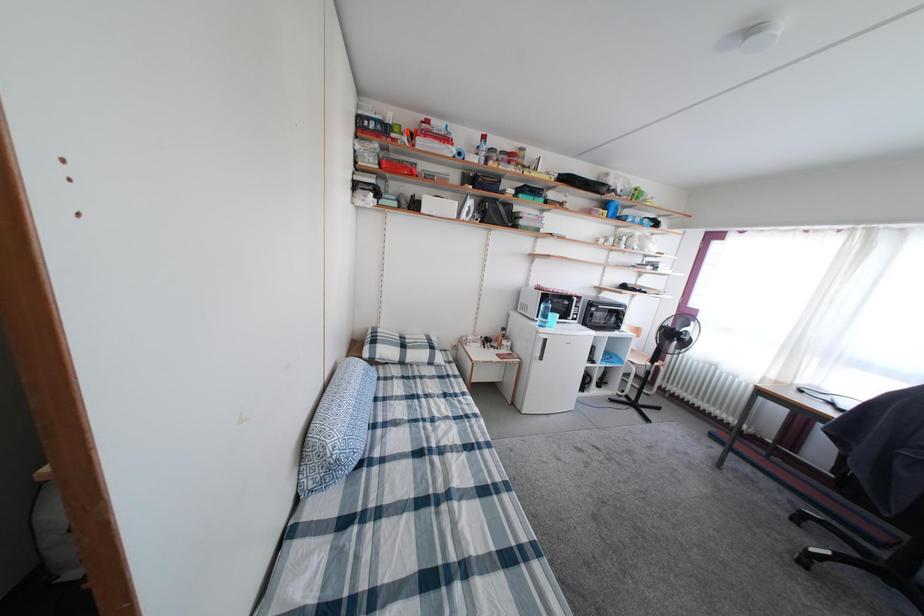
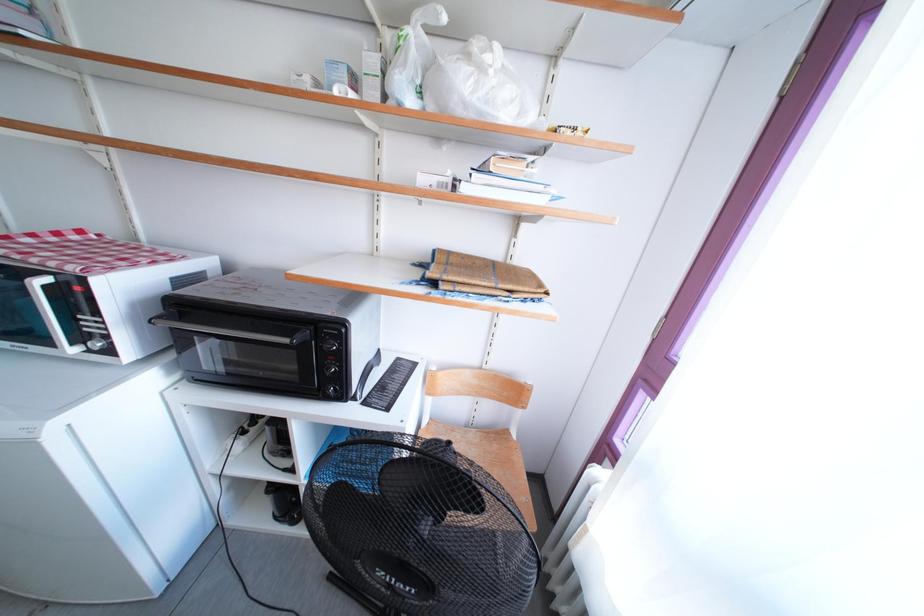
What movement of the cameraman would produce the second image?

The movement direction of the cameraman is right, forward.